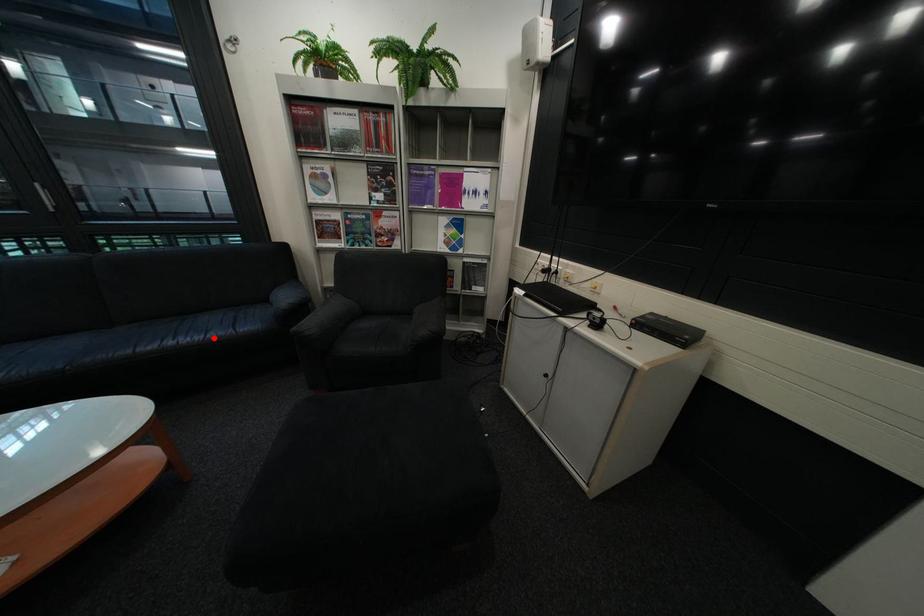
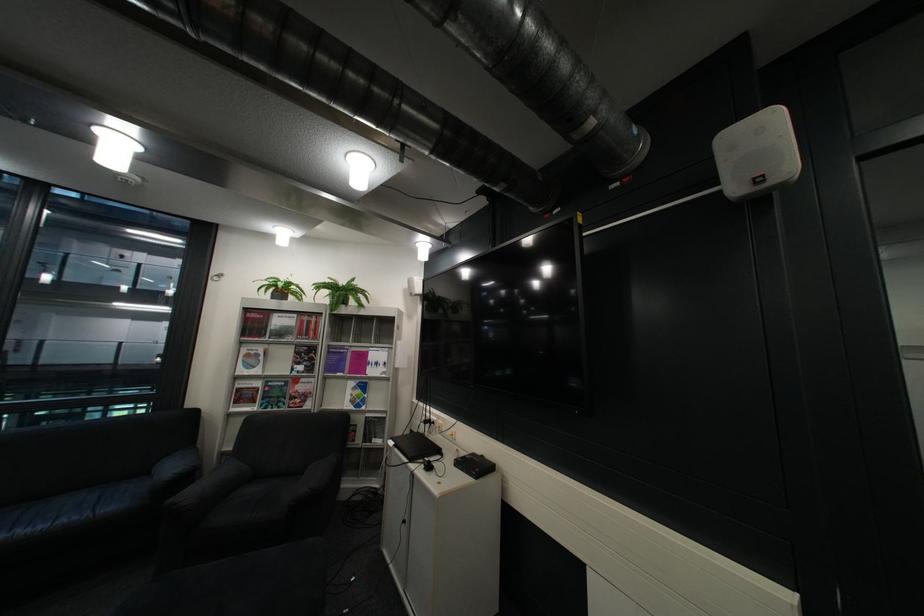
Question: I am providing you with two images of the same scene from different viewpoints. A red point is shown in image1. For the corresponding object point in image2, is it positioned nearer or farther from the camera?

Choices:
 (A) Nearer
 (B) Farther

Answer: (A)